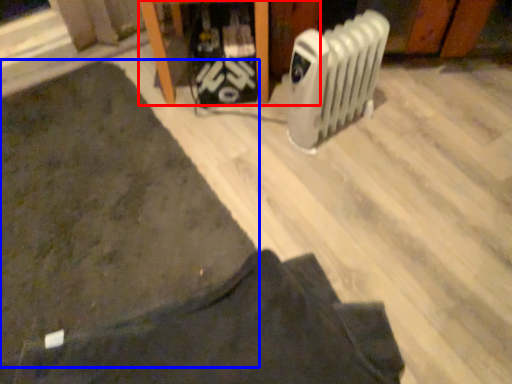
Question: Which object is closer to the camera taking this photo, furniture (highlighted by a red box) or mat (highlighted by a blue box)?

Choices:
 (A) furniture
 (B) mat

Answer: (B)